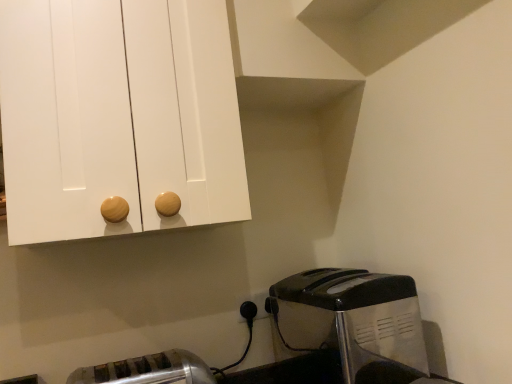
Question: Is satin silver toaster at lower left, placed as the first toaster when sorted from left to right, wider than metallic silver toaster at lower right, the first toaster in the right-to-left sequence?

Choices:
 (A) yes
 (B) no

Answer: (B)

Question: Does satin silver toaster at lower left, placed as the first toaster when sorted from left to right, have a smaller size compared to metallic silver toaster at lower right, which is the 2th toaster in left-to-right order?

Choices:
 (A) no
 (B) yes

Answer: (B)

Question: Could you tell me if satin silver toaster at lower left, which appears as the 2th toaster when viewed from the right, is turned towards metallic silver toaster at lower right, the first toaster in the right-to-left sequence?

Choices:
 (A) yes
 (B) no

Answer: (B)

Question: From the image's perspective, is satin silver toaster at lower left, which appears as the 2th toaster when viewed from the right, above metallic silver toaster at lower right, which is the 2th toaster in left-to-right order?

Choices:
 (A) no
 (B) yes

Answer: (A)

Question: Is satin silver toaster at lower left, which appears as the 2th toaster when viewed from the right, taller than metallic silver toaster at lower right, which is the 2th toaster in left-to-right order?

Choices:
 (A) yes
 (B) no

Answer: (B)

Question: Does point (251, 294) appear closer or farther from the camera than point (371, 375)?

Choices:
 (A) farther
 (B) closer

Answer: (A)

Question: Looking at their shapes, would you say white plastic electric outlet at lower center is wider or thinner than metallic silver toaster at lower right, which is the 2th toaster in left-to-right order?

Choices:
 (A) thin
 (B) wide

Answer: (A)

Question: Is white plastic electric outlet at lower center inside the boundaries of metallic silver toaster at lower right, which is the 2th toaster in left-to-right order, or outside?

Choices:
 (A) outside
 (B) inside

Answer: (A)

Question: From the image's perspective, is white plastic electric outlet at lower center positioned above or below metallic silver toaster at lower right, the first toaster in the right-to-left sequence?

Choices:
 (A) below
 (B) above

Answer: (B)

Question: From a real-world perspective, is satin silver toaster at lower left, which appears as the 2th toaster when viewed from the right, physically located above or below white plastic electric outlet at lower center?

Choices:
 (A) below
 (B) above

Answer: (A)

Question: In terms of height, does satin silver toaster at lower left, which appears as the 2th toaster when viewed from the right, look taller or shorter compared to white plastic electric outlet at lower center?

Choices:
 (A) short
 (B) tall

Answer: (B)

Question: Visually, is satin silver toaster at lower left, which appears as the 2th toaster when viewed from the right, positioned to the left or to the right of white plastic electric outlet at lower center?

Choices:
 (A) right
 (B) left

Answer: (B)

Question: In the image, is satin silver toaster at lower left, placed as the first toaster when sorted from left to right, positioned in front of or behind white plastic electric outlet at lower center?

Choices:
 (A) behind
 (B) front

Answer: (B)

Question: Is satin silver toaster at lower left, placed as the first toaster when sorted from left to right, wider or thinner than metallic silver toaster at lower right, the first toaster in the right-to-left sequence?

Choices:
 (A) thin
 (B) wide

Answer: (A)

Question: Is satin silver toaster at lower left, which appears as the 2th toaster when viewed from the right, inside the boundaries of metallic silver toaster at lower right, which is the 2th toaster in left-to-right order, or outside?

Choices:
 (A) inside
 (B) outside

Answer: (B)